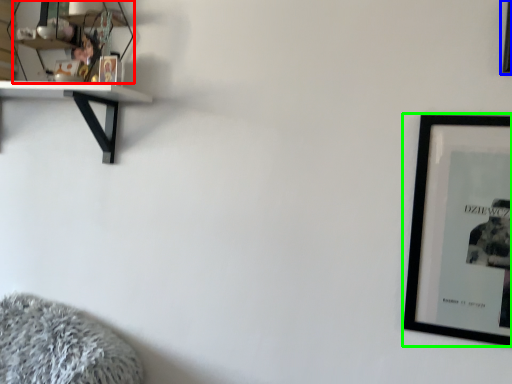
Question: Which is nearer to the shelf (highlighted by a red box)? picture frame (highlighted by a blue box) or picture frame (highlighted by a green box).

Choices:
 (A) picture frame
 (B) picture frame

Answer: (B)